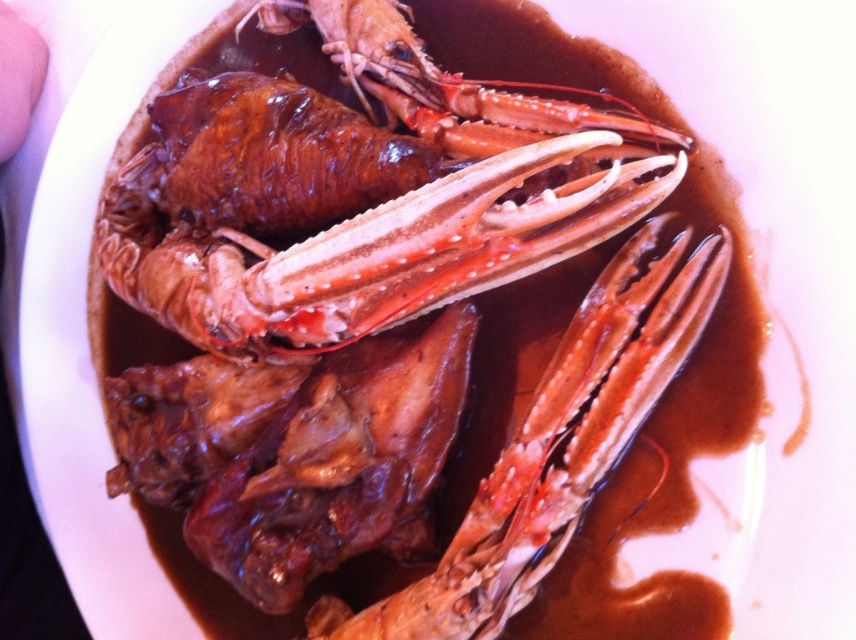
Between shiny brown lobster at center and shiny orange lobster claw at center, which one is positioned lower?

shiny orange lobster claw at center is lower down.

Who is higher up, shiny brown lobster at center or shiny orange lobster claw at center?

Positioned higher is shiny brown lobster at center.

Who is more distant from viewer, (349, 141) or (575, 413)?

The point (349, 141) is more distant.

Where is `shiny brown lobster at center`? The height and width of the screenshot is (640, 856). shiny brown lobster at center is located at coordinates (339, 216).

Which of these two, shiny brown crab at center or shiny orange lobster claw at center, stands taller?

With more height is shiny brown crab at center.

Between shiny brown crab at center and shiny orange lobster claw at center, which one appears on the right side from the viewer's perspective?

shiny orange lobster claw at center

The width and height of the screenshot is (856, 640). What do you see at coordinates (331, 268) in the screenshot?
I see `shiny brown crab at center` at bounding box center [331, 268].

The image size is (856, 640). In order to click on shiny brown crab at center in this screenshot , I will do `click(331, 268)`.

Who is more forward, (x=179, y=100) or (x=183, y=307)?

Point (x=183, y=307) is in front.

Is shiny brown crab at center wider than shiny brown lobster at center?

Indeed, shiny brown crab at center has a greater width compared to shiny brown lobster at center.

In order to click on shiny brown crab at center in this screenshot , I will do `click(331, 268)`.

This screenshot has height=640, width=856. In order to click on shiny brown crab at center in this screenshot , I will do tap(331, 268).